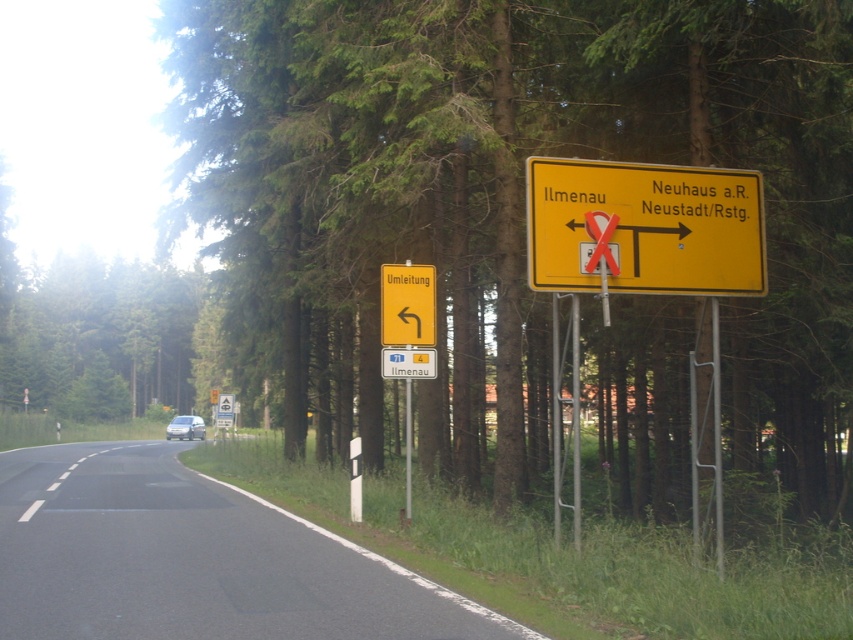
Which of these two, yellow matte sign at upper right or yellow plastic road sign at upper center, stands taller?

yellow matte sign at upper right

Can you confirm if yellow matte sign at upper right is smaller than yellow plastic road sign at upper center?

Incorrect, yellow matte sign at upper right is not smaller in size than yellow plastic road sign at upper center.

Where is `yellow matte sign at upper right`? Image resolution: width=853 pixels, height=640 pixels. yellow matte sign at upper right is located at coordinates (643, 227).

Is green leafy tree at center above yellow plastic road sign at upper center?

Yes.

Can you confirm if green leafy tree at center is bigger than yellow plastic road sign at upper center?

Correct, green leafy tree at center is larger in size than yellow plastic road sign at upper center.

Who is more forward, (712, 138) or (421, 364)?

Positioned in front is point (421, 364).

I want to click on green leafy tree at center, so click(514, 200).

Who is higher up, yellow plastic road sign at upper center or white matte van at center?

yellow plastic road sign at upper center is higher up.

Which of these two, yellow plastic road sign at upper center or white matte van at center, stands shorter?

yellow plastic road sign at upper center is shorter.

Locate an element on the screen. This screenshot has height=640, width=853. yellow plastic road sign at upper center is located at coordinates (408, 362).

I want to click on yellow plastic road sign at upper center, so click(x=408, y=362).